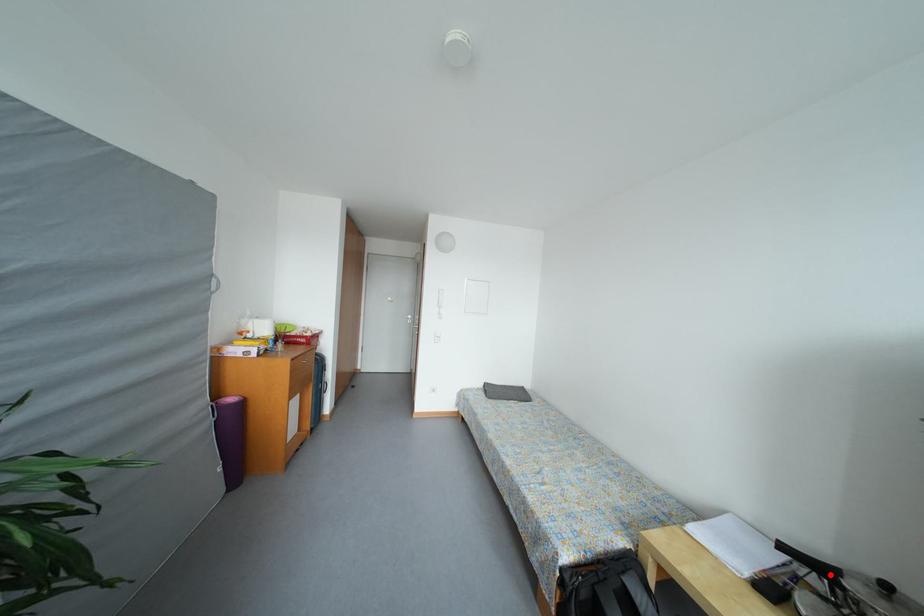
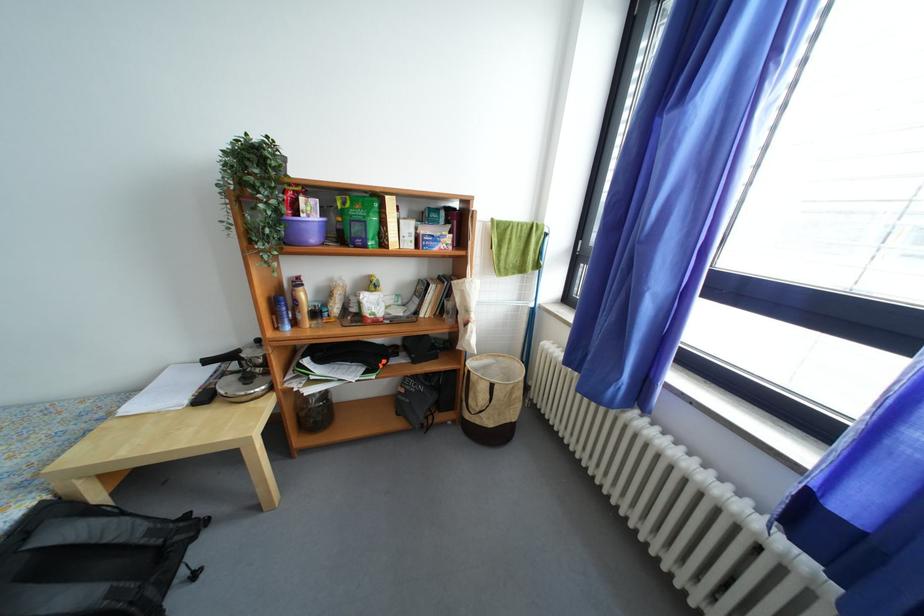
Question: A red point is marked in image1. In image2, is the corresponding 3D point closer to the camera or farther? Reply with the corresponding letter.

Choices:
 (A) The corresponding 3D point is closer.
 (B) The corresponding 3D point is farther.

Answer: (B)